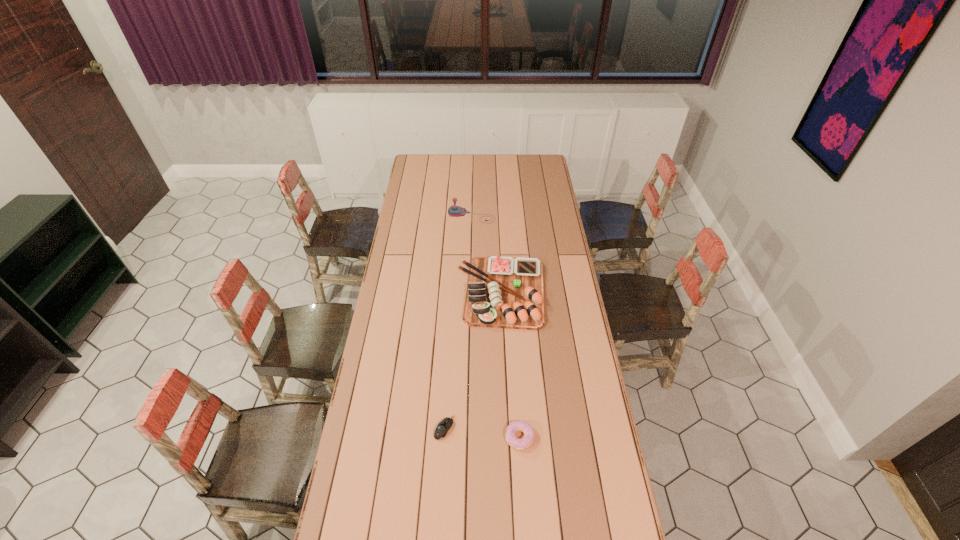
I want to click on the farthest object, so click(454, 211).

This screenshot has width=960, height=540. What are the coordinates of `the tallest object` in the screenshot? It's located at (454, 211).

Locate an element on the screen. the third nearest object is located at coordinates (502, 292).

Image resolution: width=960 pixels, height=540 pixels. Find the location of `the third shortest object`. the third shortest object is located at coordinates (502, 292).

What are the coordinates of `doughnut` in the screenshot? It's located at point(516,443).

What are the coordinates of `the shortest object` in the screenshot? It's located at (443, 427).

At what (x,y) coordinates should I click in order to perform the action: click on vacant region located on the right of the tallest object. Please return your answer as a coordinate pair (x, y). The width and height of the screenshot is (960, 540). Looking at the image, I should click on (532, 216).

The width and height of the screenshot is (960, 540). In order to click on free point located 0.390m on the front of the platter in this screenshot , I will do `click(508, 417)`.

In order to click on vacant space located 0.400m on the back of the doughnut in this screenshot , I will do `click(513, 334)`.

Where is `free space located on the left of the shortest object`? Image resolution: width=960 pixels, height=540 pixels. free space located on the left of the shortest object is located at coordinates (389, 428).